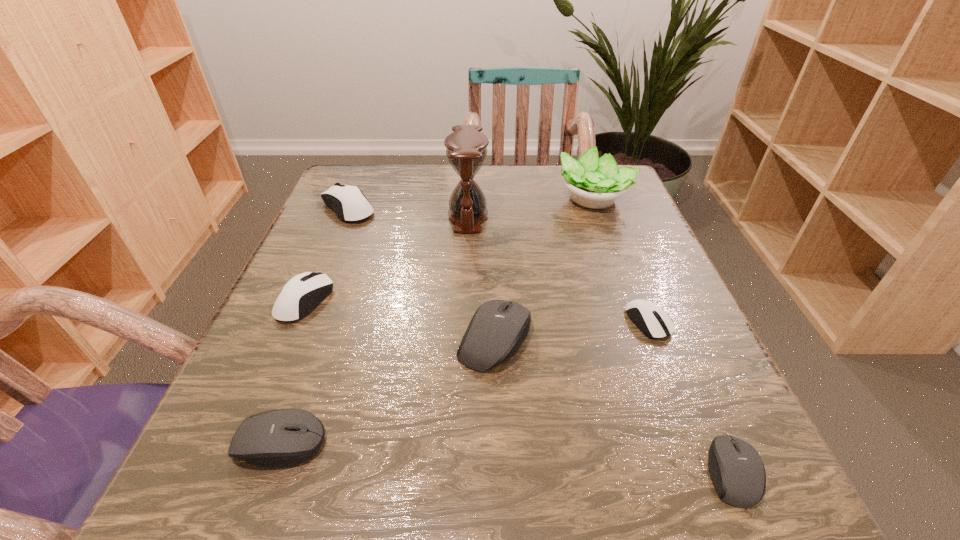
Locate which black computer equipment is the second closest to the smallest white mouse. Please provide its 2D coordinates. Your answer should be formatted as a tuple, i.e. [(x, y)], where the tuple contains the x and y coordinates of a point satisfying the conditions above.

[(736, 469)]

This screenshot has height=540, width=960. What are the coordinates of `free space that satisfies the following two spatial constraints: 1. on the front side of the lettuce; 2. on the left side of the rightmost black computer equipment` in the screenshot? It's located at (697, 471).

Locate an element on the screen. The height and width of the screenshot is (540, 960). vacant space that satisfies the following two spatial constraints: 1. on the front side of the smallest white mouse; 2. on the left side of the second smallest white mouse is located at coordinates (296, 322).

Identify the location of vacant space that satisfies the following two spatial constraints: 1. on the front side of the second smallest black computer equipment; 2. on the left side of the rightmost black computer equipment. The height and width of the screenshot is (540, 960). (269, 471).